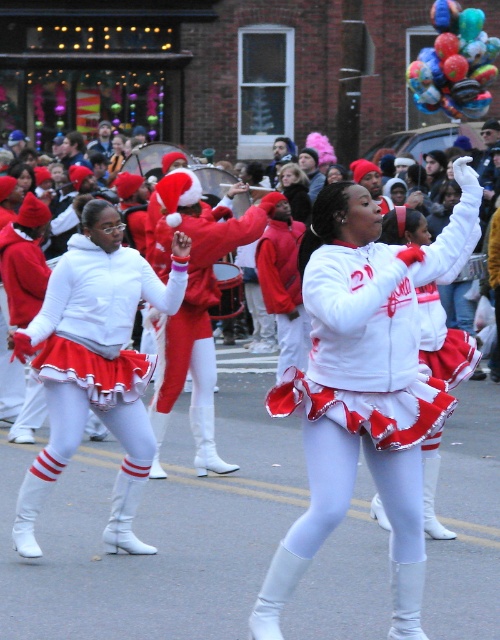
Question: Does white matte cheerleader at center have a lesser width compared to white matte uniform at center?

Choices:
 (A) yes
 (B) no

Answer: (B)

Question: Which object is closer to the camera taking this photo?

Choices:
 (A) white matte cheerleader at center
 (B) white matte/red skirt at center
 (C) red velvet santa hat at center
 (D) white matte uniform at center

Answer: (A)

Question: Based on their relative distances, which object is farther from the white matte cheerleader at center?

Choices:
 (A) white matte/red skirt at center
 (B) shiny metallic balloons at upper right

Answer: (B)

Question: Can you confirm if white matte cheerleader at center is positioned to the right of white matte uniform at center?

Choices:
 (A) yes
 (B) no

Answer: (A)

Question: Which is nearer to the red velvet santa hat at center?

Choices:
 (A) white matte uniform at center
 (B) white matte cheerleader at center

Answer: (B)

Question: Is red velvet santa hat at center wider than shiny metallic balloons at upper right?

Choices:
 (A) yes
 (B) no

Answer: (B)